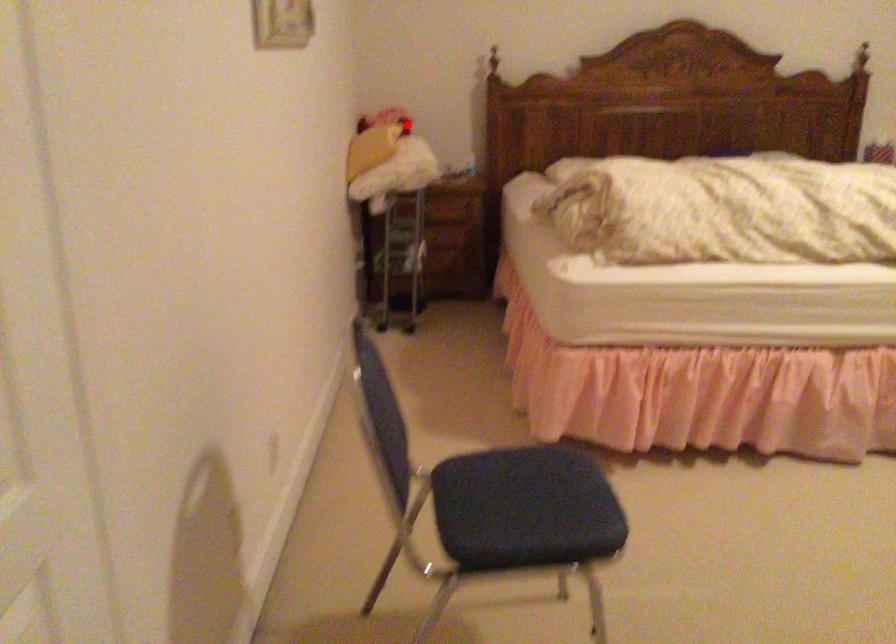
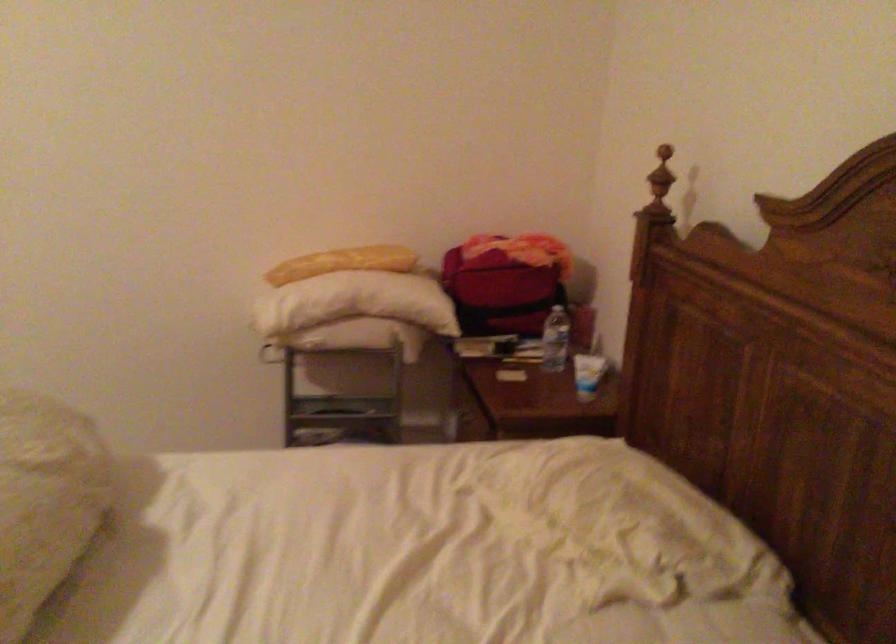
Question: I am providing you with two images of the same scene from different viewpoints. Given a red point in image1, look at the same physical point in image2. Is it:

Choices:
 (A) Closer to the viewpoint
 (B) Farther from the viewpoint

Answer: (A)